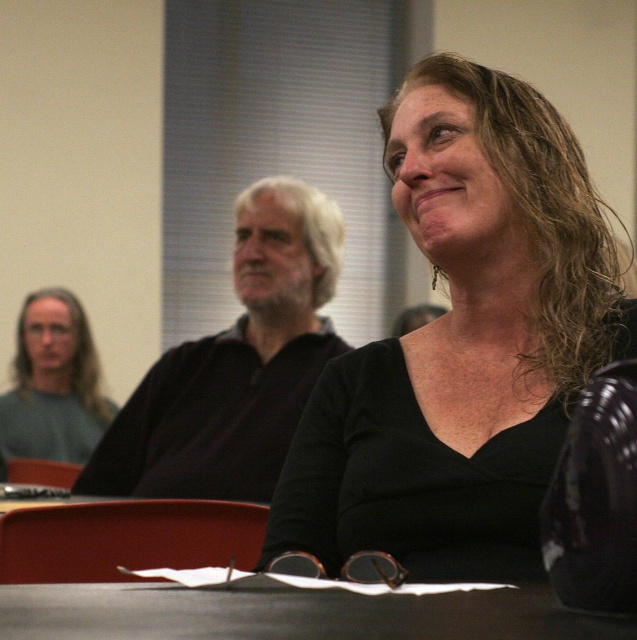
Is the position of dark brown shirt at center less distant than that of smooth black table at center?

No, dark brown shirt at center is behind smooth black table at center.

Does point (283, 228) come in front of point (501, 605)?

No.

Between point (240, 440) and point (326, 632), which one is positioned in front?

Point (326, 632)

Locate an element on the screen. dark brown shirt at center is located at coordinates (234, 364).

Does black matte shirt at center have a greater width compared to smooth black table at center?

No, black matte shirt at center is not wider than smooth black table at center.

What do you see at coordinates (462, 342) in the screenshot? This screenshot has height=640, width=637. I see `black matte shirt at center` at bounding box center [462, 342].

Who is more forward, (531, 484) or (438, 634)?

Point (438, 634) is more forward.

Locate an element on the screen. The image size is (637, 640). black matte shirt at center is located at coordinates (462, 342).

Between point (175, 419) and point (15, 408), which one is positioned in front?

Point (175, 419)

Does point (262, 280) come behind point (36, 323)?

No, it is not.

At what (x,y) coordinates should I click in order to perform the action: click on dark brown shirt at center. Please return your answer as a coordinate pair (x, y). The height and width of the screenshot is (640, 637). Looking at the image, I should click on (234, 364).